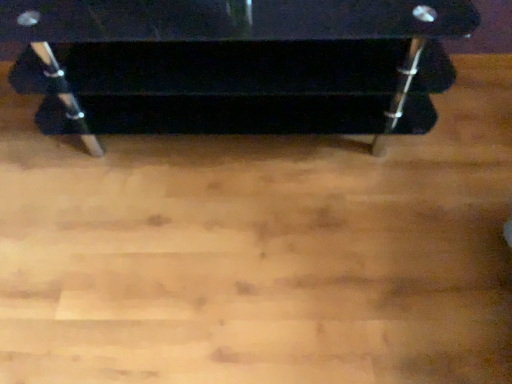
Find the location of `vacant space in front of black glossy bench at center`. vacant space in front of black glossy bench at center is located at coordinates (243, 264).